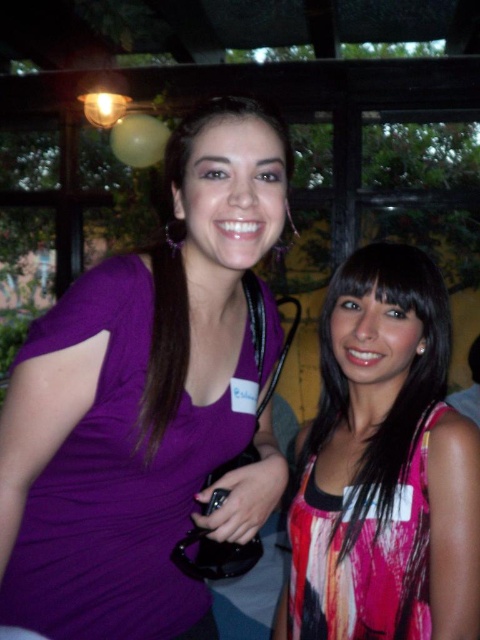
The image size is (480, 640). In order to click on purple matte shirt at center in this screenshot , I will do `click(145, 403)`.

Does purple matte shirt at center have a greater width compared to matte purple shirt at center?

Indeed, purple matte shirt at center has a greater width compared to matte purple shirt at center.

Between point (108, 326) and point (177, 324), which one is positioned in front?

Point (108, 326) is more forward.

You are a GUI agent. You are given a task and a screenshot of the screen. Output one action in this format:
    pyautogui.click(x=<x>, y=<y>)
    Task: Click on the purple matte shirt at center
    This screenshot has width=480, height=640.
    Given the screenshot: What is the action you would take?
    pyautogui.click(x=145, y=403)

Between multicolored fabric dress at right and matte purple shirt at center, which one appears on the left side from the viewer's perspective?

From the viewer's perspective, matte purple shirt at center appears more on the left side.

Can you confirm if multicolored fabric dress at right is taller than matte purple shirt at center?

Yes.

Is point (348, 598) positioned after point (178, 368)?

That is True.

Locate an element on the screen. multicolored fabric dress at right is located at coordinates (384, 467).

Is purple matte shirt at center to the right of multicolored fabric dress at right from the viewer's perspective?

In fact, purple matte shirt at center is to the left of multicolored fabric dress at right.

Does purple matte shirt at center have a smaller size compared to multicolored fabric dress at right?

No, purple matte shirt at center is not smaller than multicolored fabric dress at right.

Image resolution: width=480 pixels, height=640 pixels. What do you see at coordinates (145, 403) in the screenshot? I see `purple matte shirt at center` at bounding box center [145, 403].

You are a GUI agent. You are given a task and a screenshot of the screen. Output one action in this format:
    pyautogui.click(x=<x>, y=<y>)
    Task: Click on the purple matte shirt at center
    This screenshot has height=640, width=480.
    Given the screenshot: What is the action you would take?
    pyautogui.click(x=145, y=403)